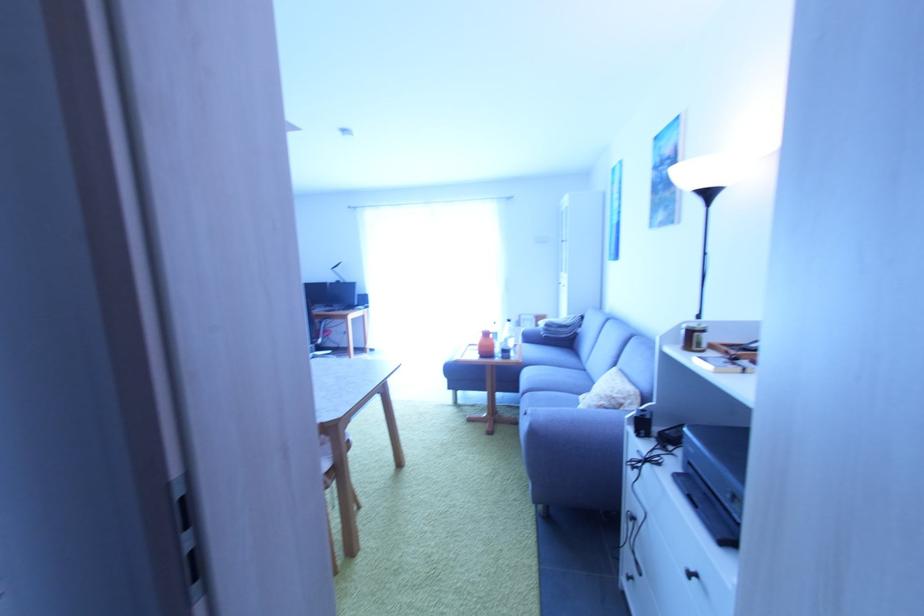
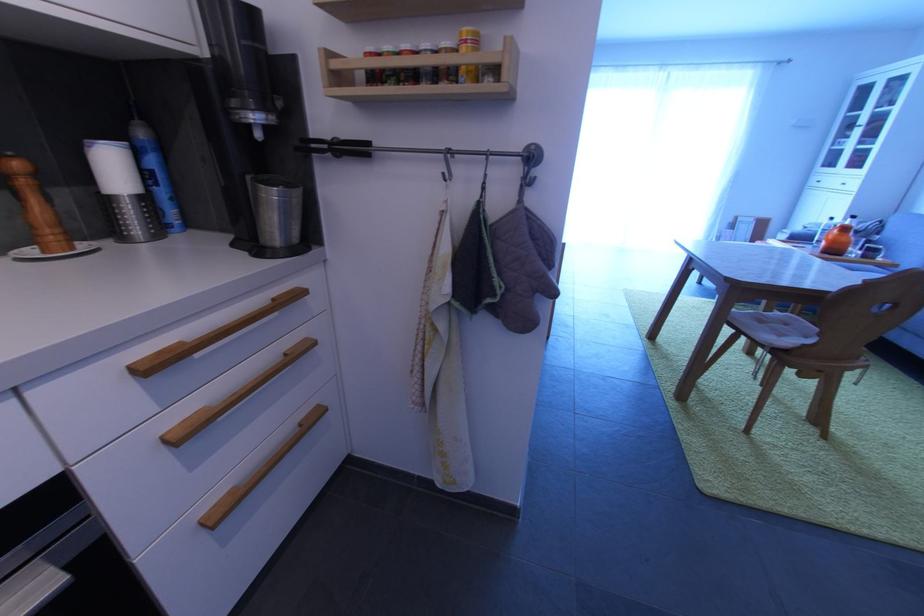
Question: The images are taken continuously from a first-person perspective. In which direction are you moving?

Choices:
 (A) Left
 (B) Right
 (C) Forward
 (D) Backward

Answer: (A)